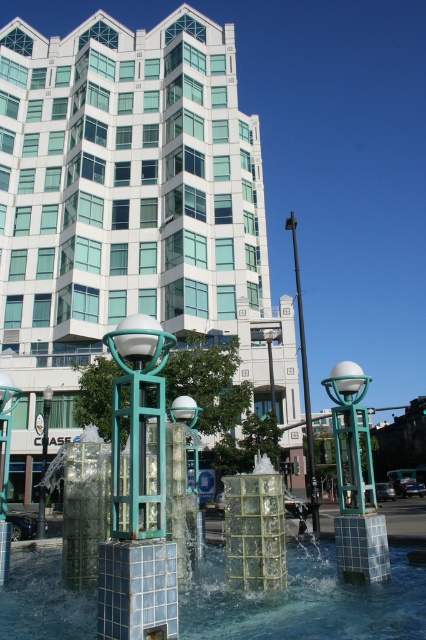
From the picture: Based on the coordinates provided, which object is located at point (x=305, y=602)?

The translucent glass water at center is located at point (x=305, y=602).

You are an architect evaluating the proportions of the white glass building at center and the translucent glass water at center in the urban scene. Which object occupies a larger area in the image?

The white glass building at center is bigger than the translucent glass water at center, so it occupies a larger area in the image.

You are standing in the urban setting and want to take a photo of the white glass building at center and the translucent glass water at center. Which object should you focus on first to ensure it appears sharp in your photo?

You should focus on the white glass building at center first because it is closer to you than the translucent glass water at center, so focusing on it will keep it sharp while the background may blur.